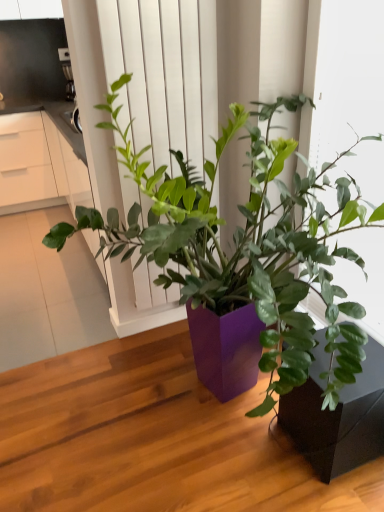
Where is `vacant area to the left of matte black pot at lower right`? vacant area to the left of matte black pot at lower right is located at coordinates (244, 452).